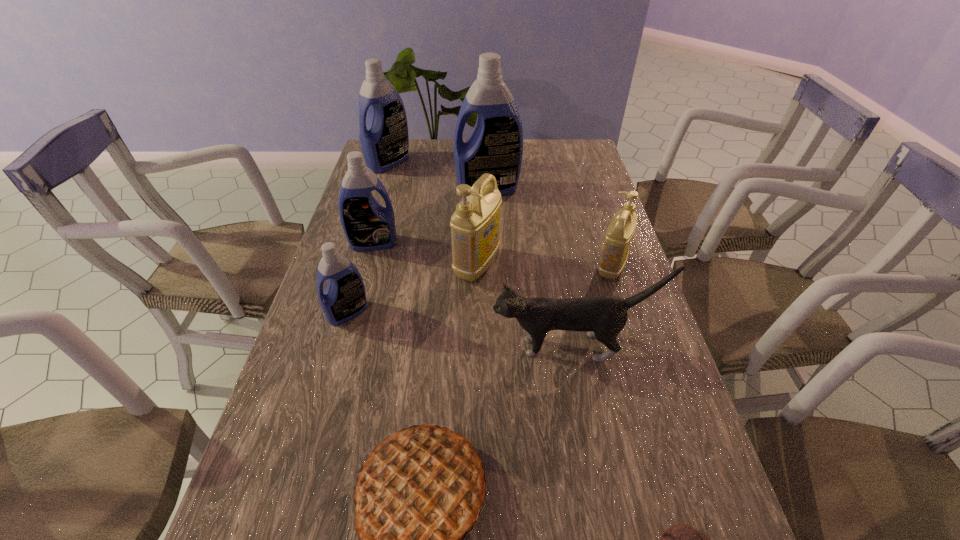
Identify which blue detergent is the second closest to the seventh farthest object. Please provide its 2D coordinates. Your answer should be formatted as a tuple, i.e. [(x, y)], where the tuple contains the x and y coordinates of a point satisfying the conditions above.

[(367, 225)]

Locate an element on the screen. The height and width of the screenshot is (540, 960). free space that satisfies the following two spatial constraints: 1. on the back side of the nearest detergent; 2. on the left side of the biggest blue detergent is located at coordinates (383, 190).

At what (x,y) coordinates should I click in order to perform the action: click on blank area in the image that satisfies the following two spatial constraints: 1. on the front side of the rightmost detergent; 2. at the face of the seventh farthest object. Please return your answer as a coordinate pair (x, y). The width and height of the screenshot is (960, 540). Looking at the image, I should click on (636, 347).

Find the location of a particular element. This screenshot has width=960, height=540. vacant area that satisfies the following two spatial constraints: 1. on the back side of the smaller beige detergent; 2. on the left side of the nearest blue detergent is located at coordinates (361, 267).